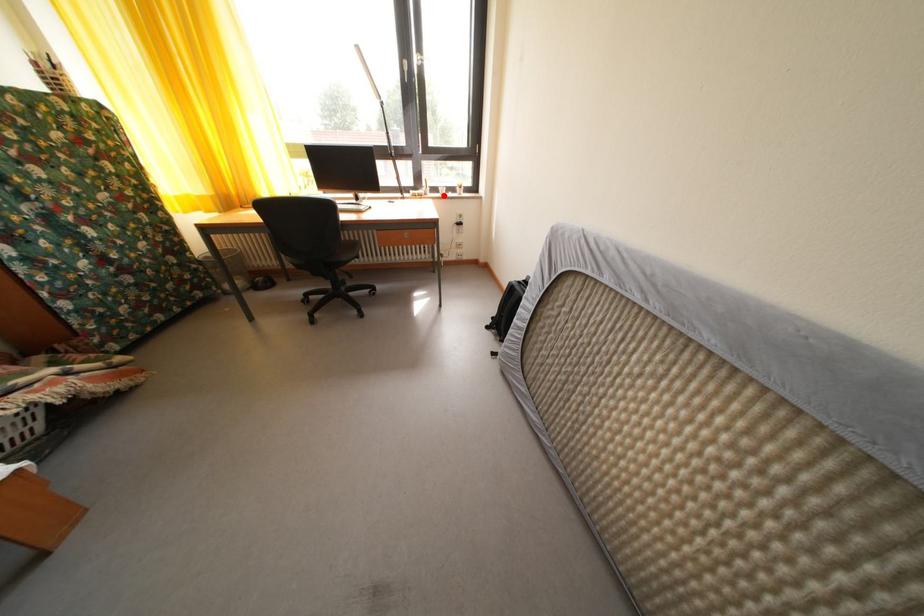
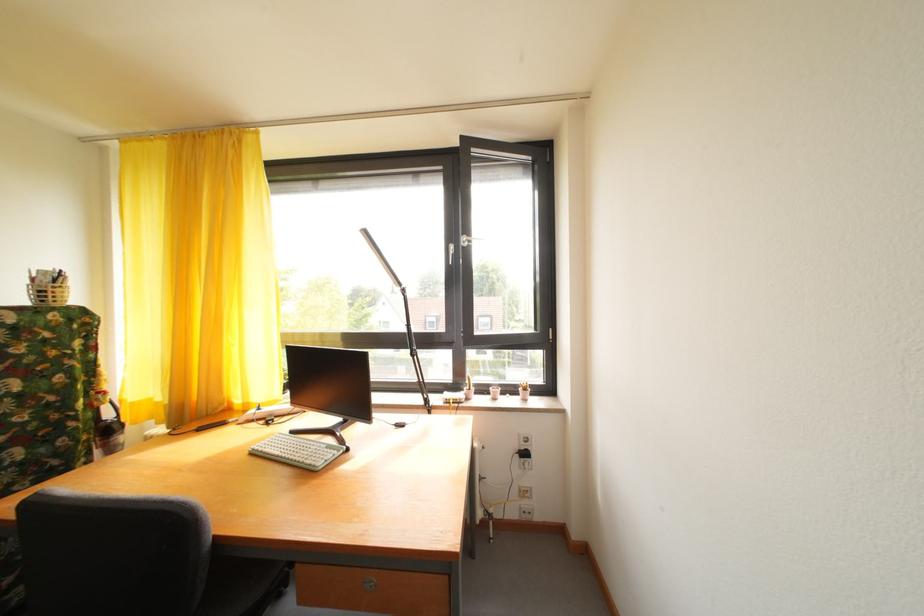
Question: A red point is marked in image1. In image2, is the corresponding 3D point closer to the camera or farther? Reply with the corresponding letter.

Choices:
 (A) The corresponding 3D point is closer.
 (B) The corresponding 3D point is farther.

Answer: (B)